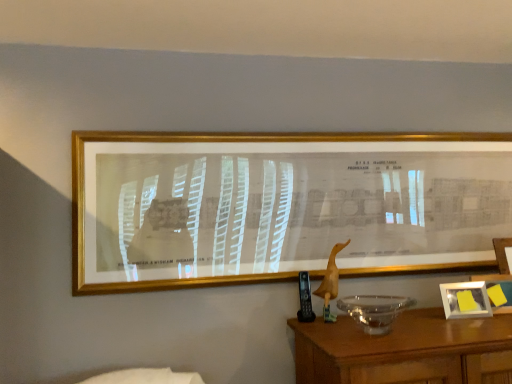
Question: Considering the relative positions of gold metallic picture frame at upper center, the 2th picture frame from the right, and transparent glass bowl at lower right in the image provided, is gold metallic picture frame at upper center, the 2th picture frame from the right, in front of transparent glass bowl at lower right?

Choices:
 (A) yes
 (B) no

Answer: (B)

Question: Is the position of gold metallic picture frame at upper center, placed as the 2th picture frame when sorted from back to front, more distant than that of transparent glass bowl at lower right?

Choices:
 (A) no
 (B) yes

Answer: (B)

Question: Does gold metallic picture frame at upper center, the first picture frame positioned from the top, appear on the right side of transparent glass bowl at lower right?

Choices:
 (A) no
 (B) yes

Answer: (A)

Question: Does gold metallic picture frame at upper center, arranged as the 1th picture frame when viewed from the left, have a lesser width compared to transparent glass bowl at lower right?

Choices:
 (A) yes
 (B) no

Answer: (A)

Question: Is transparent glass bowl at lower right completely or partially inside gold metallic picture frame at upper center, placed as the 2th picture frame when sorted from back to front?

Choices:
 (A) yes
 (B) no

Answer: (B)

Question: Is gold metallic picture frame at upper center, arranged as the 1th picture frame when viewed from the left, outside of transparent glass bowl at lower right?

Choices:
 (A) no
 (B) yes

Answer: (B)

Question: Is transparent glass bowl at lower right located outside gold metallic picture frame at upper center, arranged as the 1th picture frame when viewed from the left?

Choices:
 (A) no
 (B) yes

Answer: (B)

Question: Can you confirm if transparent glass bowl at lower right is thinner than gold metallic picture frame at upper center, placed as the 2th picture frame when sorted from back to front?

Choices:
 (A) no
 (B) yes

Answer: (A)

Question: From a real-world perspective, is transparent glass bowl at lower right on top of gold metallic picture frame at upper center, which is the second picture frame in bottom-to-top order?

Choices:
 (A) yes
 (B) no

Answer: (B)

Question: Is gold metallic picture frame at upper center, the 1th picture frame from the front, at the back of transparent glass bowl at lower right?

Choices:
 (A) yes
 (B) no

Answer: (B)

Question: Would you consider transparent glass bowl at lower right to be distant from gold metallic picture frame at upper center, the 2th picture frame from the right?

Choices:
 (A) yes
 (B) no

Answer: (B)

Question: Considering the relative positions of transparent glass bowl at lower right and gold metallic picture frame at upper center, arranged as the 1th picture frame when viewed from the left, in the image provided, is transparent glass bowl at lower right to the left of gold metallic picture frame at upper center, arranged as the 1th picture frame when viewed from the left, from the viewer's perspective?

Choices:
 (A) yes
 (B) no

Answer: (B)

Question: Is gold metallic picture frame at upper center, the 1th picture frame from the front, turned away from white plastic picture frame at lower right, acting as the 2th picture frame starting from the front?

Choices:
 (A) yes
 (B) no

Answer: (B)